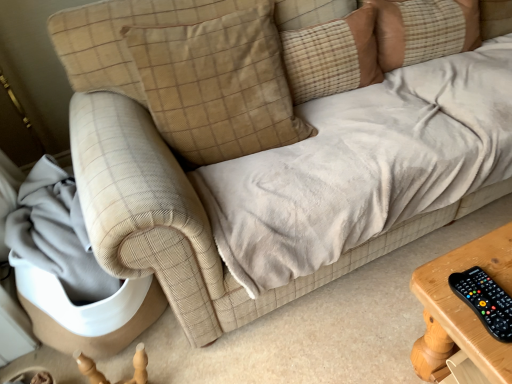
Question: Is beige corduroy pillow at upper center, marked as the first pillow in a left-to-right arrangement, closer to camera compared to brown plaid pillow at upper center, the second pillow from the right?

Choices:
 (A) no
 (B) yes

Answer: (B)

Question: Does beige corduroy pillow at upper center, the third pillow when ordered from right to left, appear on the left side of brown plaid pillow at upper center, the second pillow from the right?

Choices:
 (A) yes
 (B) no

Answer: (A)

Question: From a real-world perspective, does beige corduroy pillow at upper center, marked as the first pillow in a left-to-right arrangement, stand above brown plaid pillow at upper center, the second pillow in the left-to-right sequence?

Choices:
 (A) no
 (B) yes

Answer: (B)

Question: Is beige corduroy pillow at upper center, the third pillow when ordered from right to left, wider than brown plaid pillow at upper center, the second pillow from the right?

Choices:
 (A) no
 (B) yes

Answer: (B)

Question: Would you say beige corduroy pillow at upper center, marked as the first pillow in a left-to-right arrangement, contains brown plaid pillow at upper center, the second pillow in the left-to-right sequence?

Choices:
 (A) yes
 (B) no

Answer: (B)

Question: Considering the positions of brown plaid pillow at upper center, the second pillow from the right, and beige corduroy pillow at upper center, the third pillow when ordered from right to left, in the image, is brown plaid pillow at upper center, the second pillow from the right, bigger or smaller than beige corduroy pillow at upper center, the third pillow when ordered from right to left,?

Choices:
 (A) big
 (B) small

Answer: (B)

Question: From a real-world perspective, is brown plaid pillow at upper center, the second pillow from the right, positioned above or below beige corduroy pillow at upper center, marked as the first pillow in a left-to-right arrangement?

Choices:
 (A) below
 (B) above

Answer: (A)

Question: Considering the positions of brown plaid pillow at upper center, the second pillow from the right, and beige corduroy pillow at upper center, the third pillow when ordered from right to left, in the image, is brown plaid pillow at upper center, the second pillow from the right, taller or shorter than beige corduroy pillow at upper center, the third pillow when ordered from right to left,?

Choices:
 (A) tall
 (B) short

Answer: (B)

Question: Considering their positions, is brown plaid pillow at upper center, the second pillow from the right, located in front of or behind beige corduroy pillow at upper center, the third pillow when ordered from right to left?

Choices:
 (A) behind
 (B) front

Answer: (A)

Question: Considering the positions of beige corduroy pillow at upper center, marked as the first pillow in a left-to-right arrangement, and beige corduroy pillow at upper center, the third pillow viewed from the left, in the image, is beige corduroy pillow at upper center, marked as the first pillow in a left-to-right arrangement, bigger or smaller than beige corduroy pillow at upper center, the third pillow viewed from the left,?

Choices:
 (A) big
 (B) small

Answer: (A)

Question: Is beige corduroy pillow at upper center, marked as the first pillow in a left-to-right arrangement, taller or shorter than beige corduroy pillow at upper center, the third pillow viewed from the left?

Choices:
 (A) short
 (B) tall

Answer: (B)

Question: Considering their positions, is beige corduroy pillow at upper center, the third pillow when ordered from right to left, located in front of or behind beige corduroy pillow at upper center, which is the 1th pillow in right-to-left order?

Choices:
 (A) front
 (B) behind

Answer: (A)

Question: Is beige corduroy pillow at upper center, the third pillow when ordered from right to left, spatially inside beige corduroy pillow at upper center, which is the 1th pillow in right-to-left order, or outside of it?

Choices:
 (A) inside
 (B) outside

Answer: (B)

Question: Considering the positions of beige corduroy pillow at upper center, the third pillow viewed from the left, and brown plaid pillow at upper center, the second pillow in the left-to-right sequence, in the image, is beige corduroy pillow at upper center, the third pillow viewed from the left, taller or shorter than brown plaid pillow at upper center, the second pillow in the left-to-right sequence,?

Choices:
 (A) short
 (B) tall

Answer: (B)

Question: Would you say beige corduroy pillow at upper center, the third pillow viewed from the left, is inside or outside brown plaid pillow at upper center, the second pillow in the left-to-right sequence?

Choices:
 (A) outside
 (B) inside

Answer: (A)